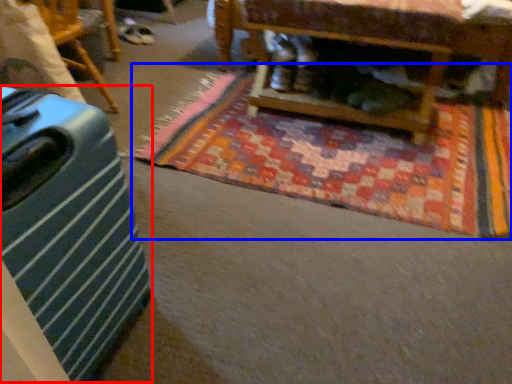
Question: Which of the following is the closest to the observer, luggage (highlighted by a red box) or mat (highlighted by a blue box)?

Choices:
 (A) luggage
 (B) mat

Answer: (A)